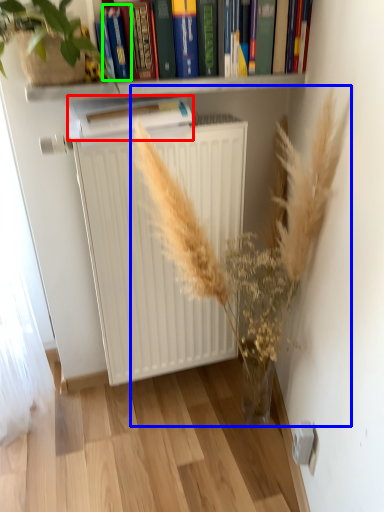
Question: Estimate the real-world distances between objects in this image. Which object is closer to paperback book (highlighted by a red box), floral arrangement (highlighted by a blue box) or paperback book (highlighted by a green box)?

Choices:
 (A) floral arrangement
 (B) paperback book

Answer: (B)